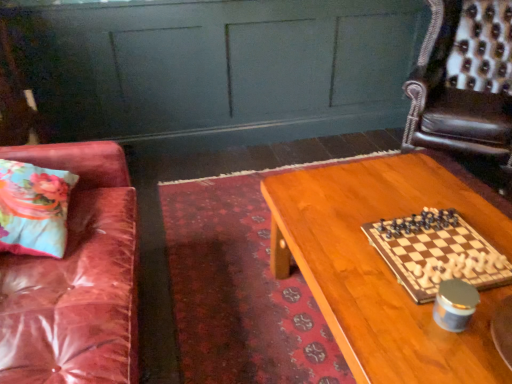
Locate an element on the screen. Image resolution: width=512 pixels, height=384 pixels. matte green dresser at upper center is located at coordinates (212, 63).

At what (x,y) coordinates should I click in order to perform the action: click on wooden chessboard at center. Please return your answer as a coordinate pair (x, y). This screenshot has width=512, height=384. Looking at the image, I should click on (437, 252).

Find the location of a particular element. The image size is (512, 384). wooden table at center is located at coordinates (385, 264).

Find the location of a particular element. The image size is (512, 384). floral fabric pillow at left is located at coordinates (34, 208).

Describe the element at coordinates (464, 81) in the screenshot. I see `leather armchair at upper right` at that location.

At what (x,y) coordinates should I click in order to perform the action: click on matte green dresser at upper center. Please return your answer as a coordinate pair (x, y). Image resolution: width=512 pixels, height=384 pixels. Looking at the image, I should click on (212, 63).

Would you consider wooden table at center to be distant from floral fabric pillow at left?

Actually, wooden table at center and floral fabric pillow at left are a little close together.

From a real-world perspective, which is physically below, wooden table at center or floral fabric pillow at left?

In real-world perspective, wooden table at center is lower.

Image resolution: width=512 pixels, height=384 pixels. What are the coordinates of `table lying on the right of floral fabric pillow at left` in the screenshot? It's located at (385, 264).

Does matte green dresser at upper center come behind wooden table at center?

Yes.

Is matte green dresser at upper center looking in the opposite direction of wooden table at center?

matte green dresser at upper center does not have its back to wooden table at center.

How different are the orientations of matte green dresser at upper center and wooden table at center in degrees?

91.7 degrees separate the facing orientations of matte green dresser at upper center and wooden table at center.

Is matte green dresser at upper center not near wooden table at center?

matte green dresser at upper center is positioned a significant distance from wooden table at center.

Can you tell me how much matte green dresser at upper center and wooden chessboard at center differ in facing direction?

The angular difference between matte green dresser at upper center and wooden chessboard at center is 90.2 degrees.

From a real-world perspective, does matte green dresser at upper center sit lower than wooden chessboard at center?

Yes, from a real-world perspective, matte green dresser at upper center is under wooden chessboard at center.

From the image's perspective, does matte green dresser at upper center appear lower than wooden chessboard at center?

Actually, matte green dresser at upper center appears above wooden chessboard at center in the image.

Between matte green dresser at upper center and wooden chessboard at center, which one has less height?

wooden chessboard at center is shorter.

Which is more to the right, matte green dresser at upper center or leather armchair at upper right?

From the viewer's perspective, leather armchair at upper right appears more on the right side.

Is matte green dresser at upper center placed right next to leather armchair at upper right?

No, matte green dresser at upper center is not beside leather armchair at upper right.

Between matte green dresser at upper center and leather armchair at upper right, which one has more height?

matte green dresser at upper center is taller.

Which is behind, matte green dresser at upper center or leather armchair at upper right?

Positioned behind is matte green dresser at upper center.

Between wooden table at center and leather armchair at upper right, which one appears on the left side from the viewer's perspective?

wooden table at center is more to the left.

Is wooden table at center inside the boundaries of leather armchair at upper right, or outside?

wooden table at center exists outside the volume of leather armchair at upper right.

Is point (487, 201) farther from camera compared to point (439, 113)?

No, it is not.

Considering the sizes of objects wooden table at center and leather armchair at upper right in the image provided, who is taller, wooden table at center or leather armchair at upper right?

leather armchair at upper right.

Considering the positions of objects leather armchair at upper right and wooden chessboard at center in the image provided, who is more to the left, leather armchair at upper right or wooden chessboard at center?

wooden chessboard at center.

Is leather armchair at upper right wider or thinner than wooden chessboard at center?

Clearly, leather armchair at upper right has more width compared to wooden chessboard at center.

Is leather armchair at upper right aimed at wooden chessboard at center?

Yes, leather armchair at upper right is turned towards wooden chessboard at center.

Is leather armchair at upper right completely or partially outside of wooden chessboard at center?

That's correct, leather armchair at upper right is outside of wooden chessboard at center.

Looking at this image, from a real-world perspective, which is physically above, matte green dresser at upper center or floral fabric pillow at left?

floral fabric pillow at left, from a real-world perspective.

Is matte green dresser at upper center bigger or smaller than floral fabric pillow at left?

In the image, matte green dresser at upper center appears to be larger than floral fabric pillow at left.

How far apart are matte green dresser at upper center and floral fabric pillow at left?

matte green dresser at upper center and floral fabric pillow at left are 4.84 feet apart.

Which object is more forward, matte green dresser at upper center or floral fabric pillow at left?

floral fabric pillow at left is in front.

The width and height of the screenshot is (512, 384). I want to click on table lying on the right of floral fabric pillow at left, so click(385, 264).

At what (x,y) coordinates should I click in order to perform the action: click on table in front of the matte green dresser at upper center. Please return your answer as a coordinate pair (x, y). The height and width of the screenshot is (384, 512). Looking at the image, I should click on (385, 264).

Based on their spatial positions, is wooden chessboard at center or leather armchair at upper right further from floral fabric pillow at left?

leather armchair at upper right.

Based on the photo, when comparing their distances from wooden table at center, does wooden chessboard at center or leather armchair at upper right seem further?

leather armchair at upper right is further to wooden table at center.

Looking at the image, which one is located further to floral fabric pillow at left, wooden table at center or wooden chessboard at center?

wooden chessboard at center.

Based on their spatial positions, is floral fabric pillow at left or leather armchair at upper right further from wooden chessboard at center?

Based on the image, leather armchair at upper right appears to be further to wooden chessboard at center.

Considering their positions, is matte green dresser at upper center positioned closer to floral fabric pillow at left than wooden table at center?

Among the two, wooden table at center is located nearer to floral fabric pillow at left.

Looking at the image, which one is located further to wooden chessboard at center, matte green dresser at upper center or floral fabric pillow at left?

Based on the image, matte green dresser at upper center appears to be further to wooden chessboard at center.

Based on their spatial positions, is wooden chessboard at center or floral fabric pillow at left closer to leather armchair at upper right?

The object closer to leather armchair at upper right is wooden chessboard at center.

From the image, which object appears to be nearer to wooden chessboard at center, leather armchair at upper right or wooden table at center?

wooden table at center is closer to wooden chessboard at center.

Find the location of a particular element. board game between leather armchair at upper right and wooden table at center from top to bottom is located at coordinates (437, 252).

Image resolution: width=512 pixels, height=384 pixels. I want to click on board game situated between matte green dresser at upper center and leather armchair at upper right from left to right, so click(x=437, y=252).

The height and width of the screenshot is (384, 512). I want to click on dresser between floral fabric pillow at left and leather armchair at upper right, so click(x=212, y=63).

I want to click on table between floral fabric pillow at left and wooden chessboard at center from left to right, so click(385, 264).